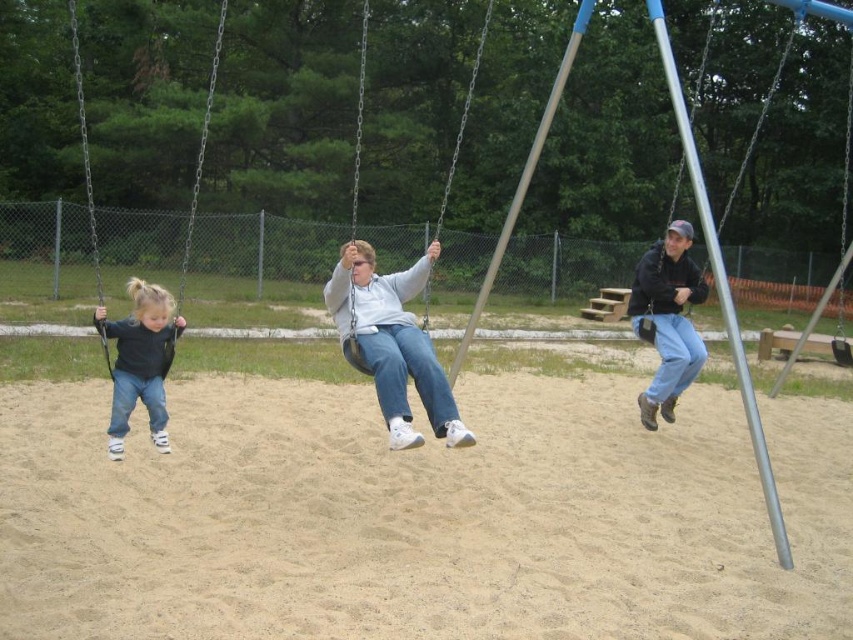
Question: Which point is closer to the camera taking this photo?

Choices:
 (A) (363, 12)
 (B) (357, 316)
 (C) (172, 353)
 (D) (126, 429)

Answer: (D)

Question: Is light brown sandy ground at center further to the viewer compared to black matte jacket at upper right?

Choices:
 (A) yes
 (B) no

Answer: (B)

Question: In this image, where is matte gray sweater at center located relative to black matte jacket at upper right?

Choices:
 (A) above
 (B) below

Answer: (B)

Question: Which object is farther from the camera taking this photo?

Choices:
 (A) light brown sandy ground at center
 (B) metallic silver swing at center
 (C) matte black swing at left
 (D) dark blue denim jeans at left

Answer: (B)

Question: Estimate the real-world distances between objects in this image. Which object is closer to the metallic silver swing at center?

Choices:
 (A) light brown sandy ground at center
 (B) matte black swing at left
 (C) dark blue denim jeans at left
 (D) matte gray sweater at center

Answer: (A)

Question: Is black matte jacket at upper right smaller than dark blue denim jeans at left?

Choices:
 (A) no
 (B) yes

Answer: (B)